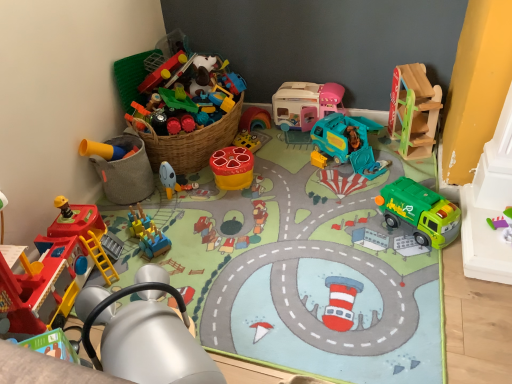
I want to click on vacant space behind blue plastic train at center, acting as the 8th toy starting from the right, so coord(162,206).